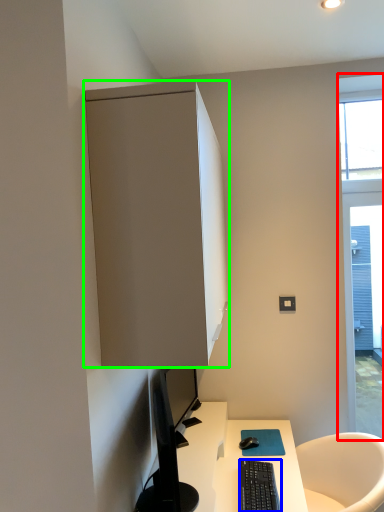
Question: Based on their relative distances, which object is nearer to window (highlighted by a red box)? Choose from computer keyboard (highlighted by a blue box) and cabinetry (highlighted by a green box).

Choices:
 (A) computer keyboard
 (B) cabinetry

Answer: (A)